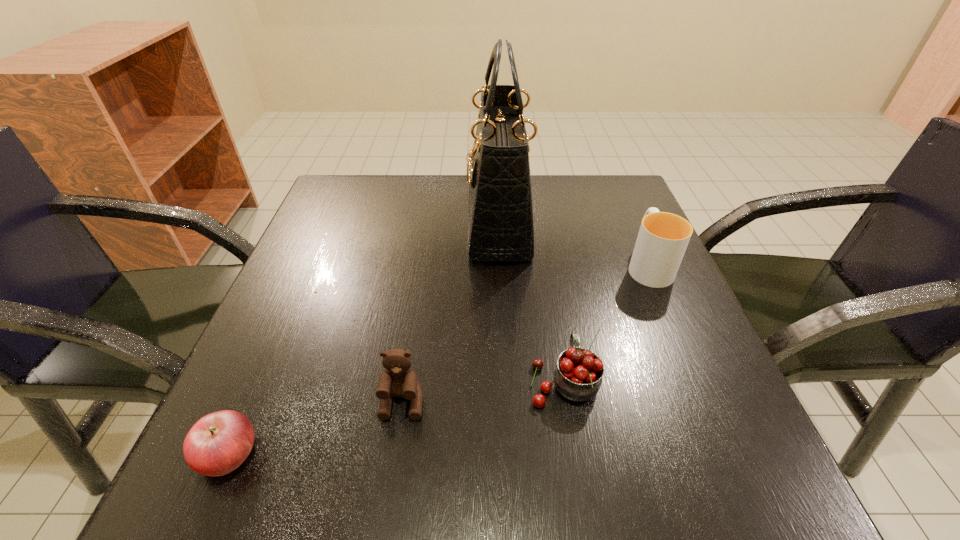
Where is `free space that satisfies the following two spatial constraints: 1. on the handle side of the cherry; 2. at the front of the handbag with visible charms`? The width and height of the screenshot is (960, 540). free space that satisfies the following two spatial constraints: 1. on the handle side of the cherry; 2. at the front of the handbag with visible charms is located at coordinates (538, 224).

In order to click on vacant space that satisfies the following two spatial constraints: 1. on the handle side of the cherry; 2. at the front of the handbag with visible charms in this screenshot , I will do `click(538, 224)`.

In order to click on vacant space that satisfies the following two spatial constraints: 1. on the handle side of the cherry; 2. at the front of the tallest object with visible charms in this screenshot , I will do `click(538, 224)`.

Image resolution: width=960 pixels, height=540 pixels. I want to click on free space that satisfies the following two spatial constraints: 1. at the front of the tallest object with visible charms; 2. on the handle side of the cherry, so click(x=508, y=381).

Locate an element on the screen. free space that satisfies the following two spatial constraints: 1. on the handle side of the cherry; 2. at the front of the handbag with visible charms is located at coordinates (538, 224).

Identify the location of vacant region that satisfies the following two spatial constraints: 1. with the handle on the side of the rightmost object; 2. at the front of the handbag with visible charms. The image size is (960, 540). (630, 224).

You are a GUI agent. You are given a task and a screenshot of the screen. Output one action in this format:
    pyautogui.click(x=<x>, y=<y>)
    Task: Click on the blank space that satisfies the following two spatial constraints: 1. at the front of the handbag with visible charms; 2. with the handle on the side of the rightmost object
    
    Given the screenshot: What is the action you would take?
    pyautogui.click(x=501, y=265)

Locate an element on the screen. This screenshot has height=540, width=960. vacant space that satisfies the following two spatial constraints: 1. at the front of the handbag with visible charms; 2. on the face of the teddy bear is located at coordinates (509, 402).

Identify the location of blank space that satisfies the following two spatial constraints: 1. on the handle side of the cherry; 2. at the front of the tallest object with visible charms. (538, 224).